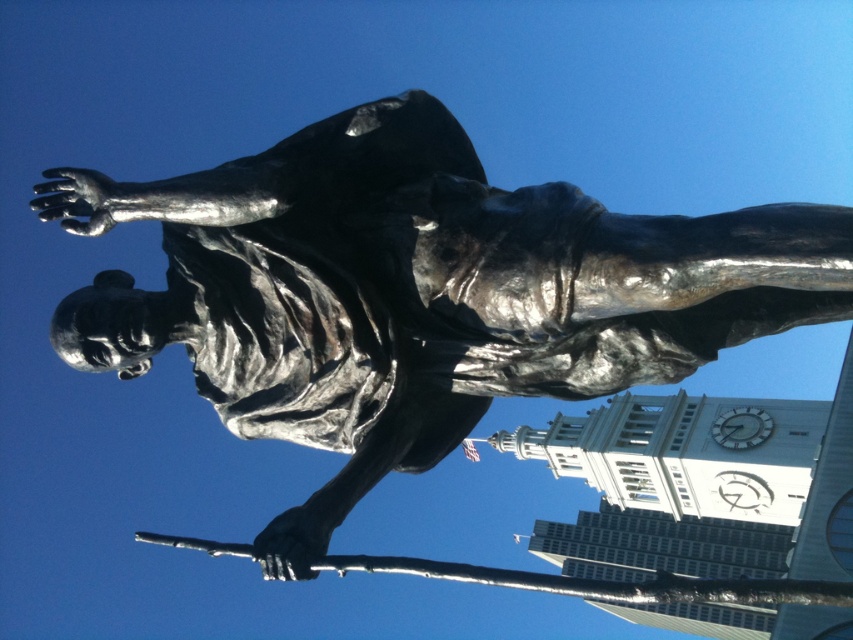
Consider the image. You are standing in front of the statue and want to check the time on the clock. Which clock should you look up to? The white stone clock tower at center or the white glossy clock at upper right?

You should look up to the white glossy clock at upper right because the white stone clock tower at center is positioned under it, meaning the white glossy clock at upper right is higher up.

You are standing in front of the statue and want to determine which of the two points, point (712, 547) or point (730, 445), is closer to you. Which one is closer?

Point (712, 547) is closer to you because it is further to the viewer than point (730, 445).